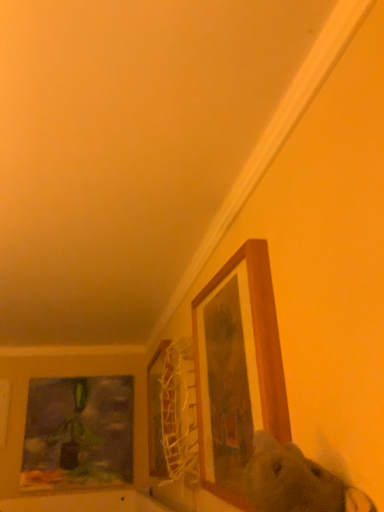
Question: Is wooden frame at upper right, arranged as the 4th picture frame when viewed from the left, wider than wooden picture frame at center, which ranks as the third picture frame in left-to-right order?

Choices:
 (A) yes
 (B) no

Answer: (A)

Question: Is wooden frame at upper right, arranged as the 4th picture frame when viewed from the left, bigger than wooden picture frame at center, which ranks as the third picture frame in left-to-right order?

Choices:
 (A) yes
 (B) no

Answer: (A)

Question: From the image's perspective, does wooden frame at upper right, the first picture frame from the right, appear lower than wooden picture frame at center, the 3th picture frame from the back?

Choices:
 (A) no
 (B) yes

Answer: (A)

Question: Considering the relative sizes of wooden frame at upper right, arranged as the 4th picture frame when viewed from the left, and wooden picture frame at center, positioned as the second picture frame in right-to-left order, in the image provided, is wooden frame at upper right, arranged as the 4th picture frame when viewed from the left, smaller than wooden picture frame at center, positioned as the second picture frame in right-to-left order,?

Choices:
 (A) no
 (B) yes

Answer: (A)

Question: Is wooden frame at upper right, which is counted as the first picture frame, starting from the front, at the right side of wooden picture frame at center, the 3th picture frame from the back?

Choices:
 (A) no
 (B) yes

Answer: (B)

Question: From the image's perspective, is wooden frame at upper right, arranged as the 4th picture frame when viewed from the left, located above wooden picture frame at center, which ranks as the third picture frame in left-to-right order?

Choices:
 (A) yes
 (B) no

Answer: (A)

Question: Is the depth of wooden picture frame at center, which ranks as the third picture frame in left-to-right order, less than that of wooden picture frame at lower left, the first picture frame when ordered from left to right?

Choices:
 (A) yes
 (B) no

Answer: (A)

Question: Considering the relative sizes of wooden picture frame at center, the 3th picture frame from the back, and wooden picture frame at lower left, the 3th picture frame from the front, in the image provided, is wooden picture frame at center, the 3th picture frame from the back, taller than wooden picture frame at lower left, the 3th picture frame from the front,?

Choices:
 (A) yes
 (B) no

Answer: (A)

Question: Is wooden picture frame at center, the 3th picture frame from the back, positioned beyond the bounds of wooden picture frame at lower left, the second picture frame when ordered from back to front?

Choices:
 (A) yes
 (B) no

Answer: (A)

Question: Does wooden picture frame at center, which ranks as the third picture frame in left-to-right order, touch wooden picture frame at lower left, the 3th picture frame from the front?

Choices:
 (A) no
 (B) yes

Answer: (A)

Question: Does wooden picture frame at center, which ranks as the third picture frame in left-to-right order, appear on the left side of wooden picture frame at lower left, the second picture frame when ordered from back to front?

Choices:
 (A) yes
 (B) no

Answer: (B)

Question: Considering the relative sizes of wooden picture frame at center, positioned as the second picture frame in right-to-left order, and wooden picture frame at lower left, the first picture frame when ordered from left to right, in the image provided, is wooden picture frame at center, positioned as the second picture frame in right-to-left order, smaller than wooden picture frame at lower left, the first picture frame when ordered from left to right,?

Choices:
 (A) no
 (B) yes

Answer: (A)

Question: Can you confirm if matte glass painting at left, which is the fourth picture frame from front to back, is smaller than wooden picture frame at lower left, the 3th picture frame from the front?

Choices:
 (A) yes
 (B) no

Answer: (B)